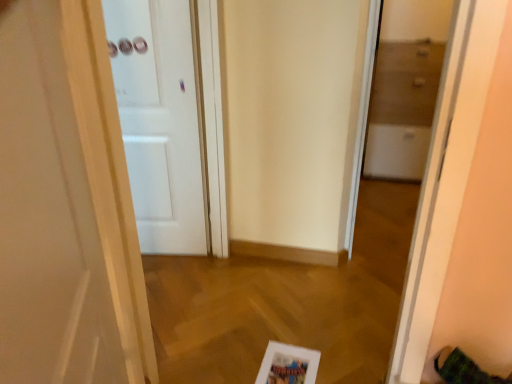
In order to face white matte picture frame at lower center, should I rotate leftwards or rightwards?

Turn right approximately 4.313 degrees to face it.

The width and height of the screenshot is (512, 384). Describe the element at coordinates (359, 132) in the screenshot. I see `transparent glass cabinet at right` at that location.

Locate an element on the screen. Image resolution: width=512 pixels, height=384 pixels. white matte picture frame at lower center is located at coordinates click(x=288, y=365).

Consider the image. How many degrees apart are the facing directions of white matte door at center, the second door in the front-to-back sequence, and white glossy door at left, acting as the first door starting from the front?

103 degrees separate the facing orientations of white matte door at center, the second door in the front-to-back sequence, and white glossy door at left, acting as the first door starting from the front.

From the image's perspective, is white matte door at center, which appears as the 1th door when viewed from the back, positioned above or below white glossy door at left, acting as the first door starting from the front?

Clearly, from the image's perspective, white matte door at center, which appears as the 1th door when viewed from the back, is above white glossy door at left, acting as the first door starting from the front.

Does white matte door at center, the second door in the front-to-back sequence, have a greater width compared to white glossy door at left, the second door viewed from the back?

Yes.

Would you say white matte door at center, the second door in the front-to-back sequence, contains white glossy door at left, acting as the first door starting from the front?

That's incorrect, white glossy door at left, acting as the first door starting from the front, is not inside white matte door at center, the second door in the front-to-back sequence.

Is white matte door at center, which appears as the 1th door when viewed from the back, a part of white matte picture frame at lower center?

That's incorrect, white matte door at center, which appears as the 1th door when viewed from the back, is not inside white matte picture frame at lower center.

Is the surface of white matte picture frame at lower center in direct contact with white matte door at center, which appears as the 1th door when viewed from the back?

No.

Considering the sizes of objects white matte picture frame at lower center and white matte door at center, the second door in the front-to-back sequence, in the image provided, who is smaller, white matte picture frame at lower center or white matte door at center, the second door in the front-to-back sequence,?

white matte picture frame at lower center.

Locate an element on the screen. This screenshot has width=512, height=384. picture frame that is below the white glossy door at left, the second door viewed from the back (from the image's perspective) is located at coordinates (288, 365).

Is white glossy door at left, the second door viewed from the back, located outside white matte picture frame at lower center?

Indeed, white glossy door at left, the second door viewed from the back, is completely outside white matte picture frame at lower center.

How different are the orientations of white glossy door at left, the second door viewed from the back, and white matte picture frame at lower center in degrees?

The facing directions of white glossy door at left, the second door viewed from the back, and white matte picture frame at lower center are 116 degrees apart.

Considering the points (28, 17) and (273, 364), which point is in front, point (28, 17) or point (273, 364)?

Point (28, 17)

The height and width of the screenshot is (384, 512). I want to click on door behind the white glossy door at left, the second door viewed from the back, so click(160, 121).

Can you confirm if white glossy door at left, the second door viewed from the back, is wider than white matte door at center, which appears as the 1th door when viewed from the back?

In fact, white glossy door at left, the second door viewed from the back, might be narrower than white matte door at center, which appears as the 1th door when viewed from the back.

Is white glossy door at left, the second door viewed from the back, positioned beyond the bounds of white matte door at center, the second door in the front-to-back sequence?

Yes, white glossy door at left, the second door viewed from the back, is outside of white matte door at center, the second door in the front-to-back sequence.

Is white glossy door at left, the second door viewed from the back, aimed at white matte door at center, the second door in the front-to-back sequence?

No.

From a real-world perspective, is transparent glass cabinet at right positioned over white glossy door at left, the second door viewed from the back, based on gravity?

Actually, transparent glass cabinet at right is physically below white glossy door at left, the second door viewed from the back, in the real world.

Is transparent glass cabinet at right positioned beyond the bounds of white glossy door at left, the second door viewed from the back?

Yes.

Which object is positioned more to the left, transparent glass cabinet at right or white glossy door at left, acting as the first door starting from the front?

From the viewer's perspective, white glossy door at left, acting as the first door starting from the front, appears more on the left side.

Based on the photo, does white matte picture frame at lower center have a larger size compared to white glossy door at left, the second door viewed from the back?

No.

Between white matte picture frame at lower center and white glossy door at left, the second door viewed from the back, which one has less height?

white matte picture frame at lower center is shorter.

Would you say white matte picture frame at lower center contains white glossy door at left, acting as the first door starting from the front?

No, white glossy door at left, acting as the first door starting from the front, is located outside of white matte picture frame at lower center.

Is point (268, 381) closer or farther from the camera than point (1, 324)?

Point (268, 381) is positioned farther from the camera compared to point (1, 324).

Is the depth of white matte door at center, the second door in the front-to-back sequence, greater than that of transparent glass cabinet at right?

Yes, it is behind transparent glass cabinet at right.

Where is `the 2nd door to the left of the transparent glass cabinet at right, counting from the anchor's position`? This screenshot has height=384, width=512. the 2nd door to the left of the transparent glass cabinet at right, counting from the anchor's position is located at coordinates (160, 121).

Is white matte door at center, which appears as the 1th door when viewed from the back, wider or thinner than transparent glass cabinet at right?

In the image, white matte door at center, which appears as the 1th door when viewed from the back, appears to be wider than transparent glass cabinet at right.

Are white matte door at center, the second door in the front-to-back sequence, and transparent glass cabinet at right located far from each other?

No, white matte door at center, the second door in the front-to-back sequence, is not far away from transparent glass cabinet at right.

Identify the location of door above the white matte door at center, which appears as the 1th door when viewed from the back (from a real-world perspective). The height and width of the screenshot is (384, 512). (66, 206).

From the white matte picture frame at lower center, count the 2nd door to the left and point to it. Please provide its 2D coordinates.

[(160, 121)]

Based on their spatial positions, is white matte picture frame at lower center or white matte door at center, which appears as the 1th door when viewed from the back, closer to white glossy door at left, the second door viewed from the back?

white matte picture frame at lower center is closer to white glossy door at left, the second door viewed from the back.

From the picture: Which object lies nearer to the anchor point white glossy door at left, the second door viewed from the back, white matte door at center, which appears as the 1th door when viewed from the back, or transparent glass cabinet at right?

The object closer to white glossy door at left, the second door viewed from the back, is white matte door at center, which appears as the 1th door when viewed from the back.

Based on their spatial positions, is white glossy door at left, the second door viewed from the back, or white matte picture frame at lower center closer to white matte door at center, the second door in the front-to-back sequence?

white glossy door at left, the second door viewed from the back, is closer to white matte door at center, the second door in the front-to-back sequence.

When comparing their distances from transparent glass cabinet at right, does white matte door at center, the second door in the front-to-back sequence, or white matte picture frame at lower center seem closer?

The object closer to transparent glass cabinet at right is white matte picture frame at lower center.

Estimate the real-world distances between objects in this image. Which object is closer to white glossy door at left, acting as the first door starting from the front, white matte picture frame at lower center or transparent glass cabinet at right?

white matte picture frame at lower center is closer to white glossy door at left, acting as the first door starting from the front.

Estimate the real-world distances between objects in this image. Which object is further from white matte picture frame at lower center, white matte door at center, the second door in the front-to-back sequence, or transparent glass cabinet at right?

white matte door at center, the second door in the front-to-back sequence, is positioned further to the anchor white matte picture frame at lower center.

Which object lies further to the anchor point white matte picture frame at lower center, transparent glass cabinet at right or white glossy door at left, the second door viewed from the back?

Among the two, white glossy door at left, the second door viewed from the back, is located further to white matte picture frame at lower center.

Considering their positions, is transparent glass cabinet at right positioned further to white glossy door at left, the second door viewed from the back, than white matte door at center, which appears as the 1th door when viewed from the back?

Based on the image, transparent glass cabinet at right appears to be further to white glossy door at left, the second door viewed from the back.

This screenshot has width=512, height=384. I want to click on glass door between white glossy door at left, the second door viewed from the back, and white matte door at center, which appears as the 1th door when viewed from the back, in the front-back direction, so click(359, 132).

Where is `picture frame between white glossy door at left, the second door viewed from the back, and transparent glass cabinet at right in the front-back direction`? picture frame between white glossy door at left, the second door viewed from the back, and transparent glass cabinet at right in the front-back direction is located at coordinates (288, 365).

Identify the location of picture frame located between white matte door at center, the second door in the front-to-back sequence, and transparent glass cabinet at right in the left-right direction. Image resolution: width=512 pixels, height=384 pixels. point(288,365).

Where is `picture frame between white glossy door at left, acting as the first door starting from the front, and white matte door at center, the second door in the front-to-back sequence, along the z-axis`? picture frame between white glossy door at left, acting as the first door starting from the front, and white matte door at center, the second door in the front-to-back sequence, along the z-axis is located at coordinates (288, 365).